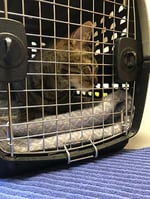
Locate an element on the screen. crate cushion is located at coordinates (74, 120).